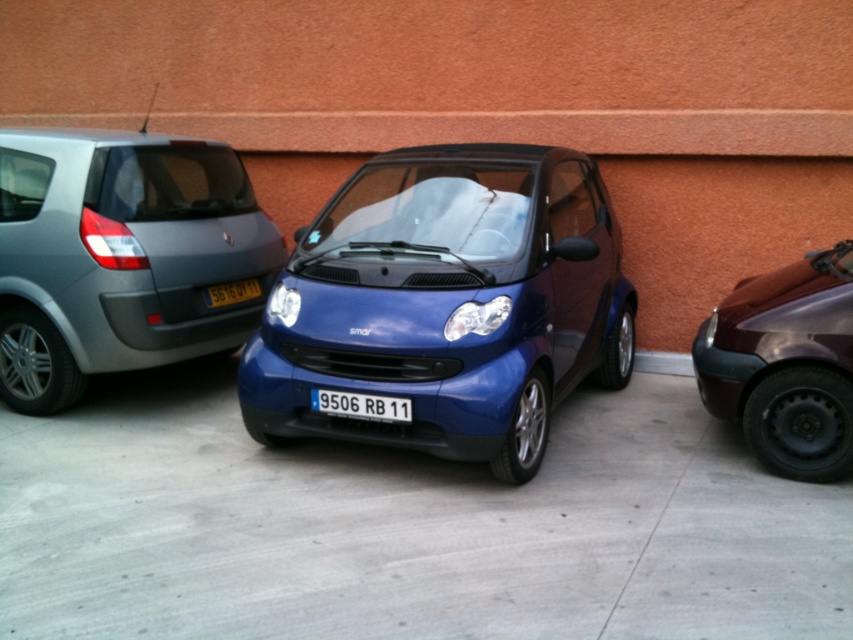
You are a delivery person trying to park a new van that is 1.8 meters wide in this parking area. You see the metallic gray minivan at left and the black plastic license plate at center. Based on their widths, can your van fit in the space between them?

The metallic gray minivan at left is wider than the black plastic license plate at center, so the space between them may be too narrow for your 1.8 meters wide van. You should check the exact measurements before attempting to park.

You are standing at point [120,257] in the parking area. What type of vehicle are you directly facing?

You are directly facing a metallic gray minivan at left located at point [120,257].

You are a parking attendant who needs to verify the distance between the two license plates. The minimum distance required for safety is 5 feet. Can the blue metallic license plate at center and the black plastic license plate at center be safely parked here?

The blue metallic license plate at center and black plastic license plate at center are 6.17 feet apart from each other, which exceeds the 5 feet safety requirement. Therefore, they can be safely parked here.